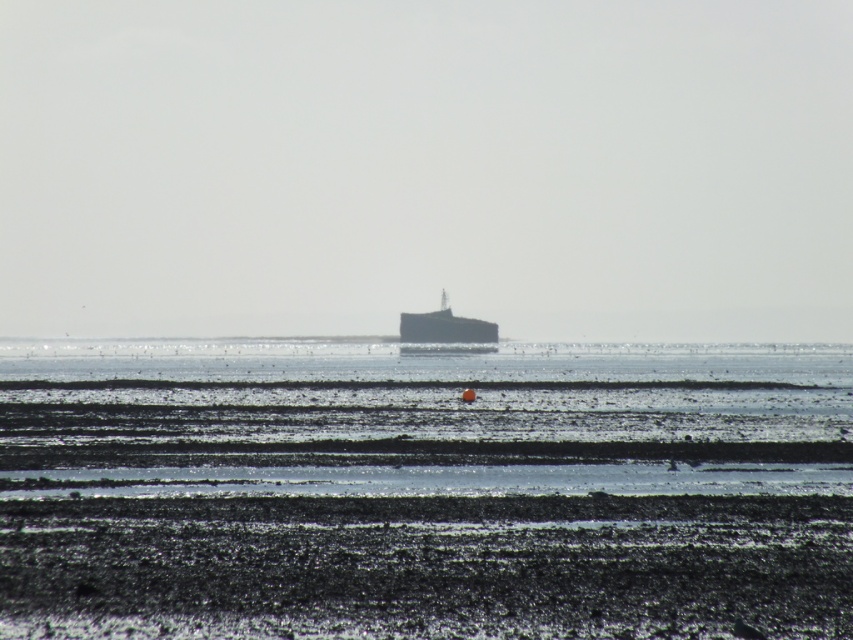
You are a delivery drone that needs to land on the black matte mud at lower center. The dark gray metallic boat at center is in your landing path. Can you safely land on the mud without hitting the boat?

The black matte mud at lower center might be wider than the dark gray metallic boat at center, so there is a possibility of finding enough space to land safely, but there is uncertainty due to the comparative width.

You are a small crab trying to cross the black matte mud at lower center to reach the clear water at center. Can you safely walk across the mud without sinking? Explain your reasoning based on the scene description.

The black matte mud at lower center has a lesser width compared to clear water at center, so the mud is narrower than the water area. Since the mud is part of the wet, dark mudflats described as uneven with ripples and ridges from the receding tide, it might be firm enough in some areas for the crab to walk across. However, the crab should be cautious as mudflats can vary in consistency, and the lesser width suggests a shorter path but potential uneven terrain.